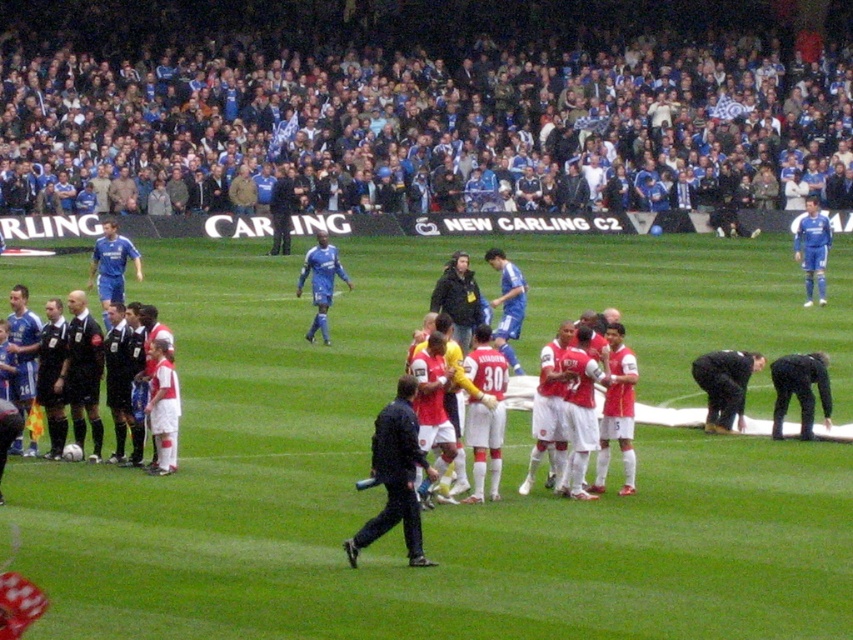
Question: Which point is farther from the camera taking this photo?

Choices:
 (A) (438, 305)
 (B) (699, 376)
 (C) (817, 244)
 (D) (773, 372)

Answer: (C)

Question: Considering the relative positions of white jersey at left and blue smooth soccer player at upper right in the image provided, where is white jersey at left located with respect to blue smooth soccer player at upper right?

Choices:
 (A) below
 (B) above

Answer: (A)

Question: Which point is farther to the camera?

Choices:
 (A) blue smooth soccer player at upper right
 (B) blue jersey at center

Answer: (A)

Question: Is black leather jacket at center further to the viewer compared to blue smooth soccer player at upper right?

Choices:
 (A) no
 (B) yes

Answer: (A)

Question: Considering the real-world distances, which object is farthest from the dark blue uniform at lower right?

Choices:
 (A) blue smooth soccer player at upper right
 (B) dark blue uniform at center
 (C) white jersey at left
 (D) black leather jacket at lower right

Answer: (A)

Question: Considering the relative positions of dark blue uniform at center and black leather jacket at center in the image provided, where is dark blue uniform at center located with respect to black leather jacket at center?

Choices:
 (A) left
 (B) right

Answer: (A)